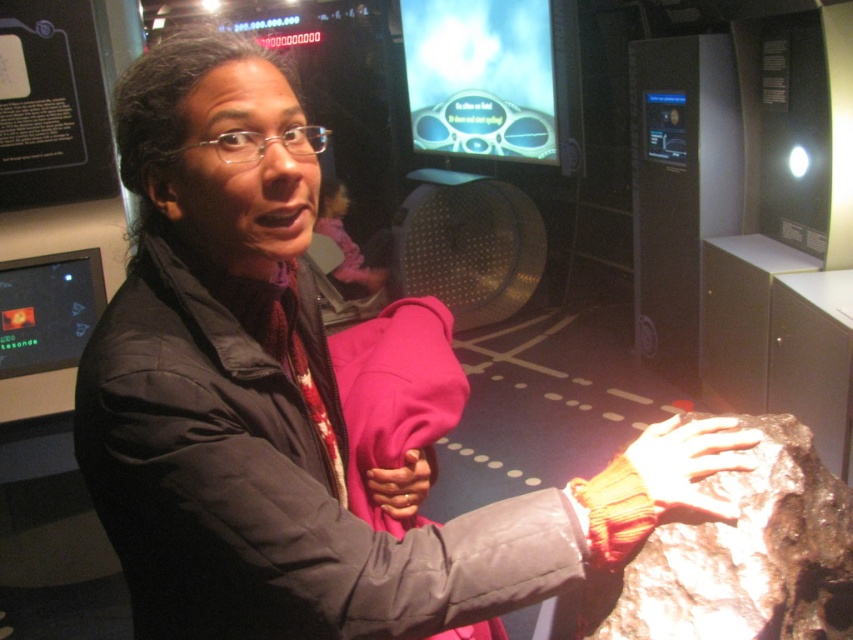
You are standing in the museum and want to touch the point at coordinates point (337, 577). The museum has a rule that you must stay at least 30 inches away from all exhibits. Can you safely touch the point without violating the rule?

The distance of point (337, 577) from viewer is 29.12 inches. Since 29.12 inches is less than the required 30 inches, touching the point would violate the museum rule.

You are navigating through a museum exhibit and need to locate the black puffy jacket at center. According to the coordinates provided, where exactly is it positioned?

The black puffy jacket at center is located at point 0.769 on the x axis and 0.313 on the y axis.